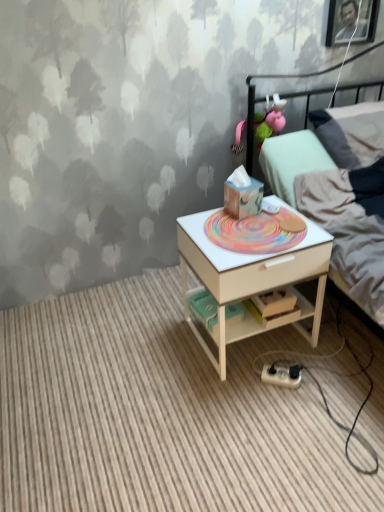
Question: Is point (279, 378) closer or farther from the camera than point (332, 211)?

Choices:
 (A) closer
 (B) farther

Answer: (A)

Question: From a real-world perspective, is white plastic power strip at lower center physically located above or below light gray fabric bed at upper right?

Choices:
 (A) below
 (B) above

Answer: (A)

Question: Estimate the real-world distances between objects in this image. Which object is farther from the white plastic power strip at lower center?

Choices:
 (A) white wood desk at center
 (B) pink fabric toy at upper center
 (C) light gray fabric bed at upper right
 (D) white wood nightstand at center

Answer: (B)

Question: Which object is the farthest from the pink fabric toy at upper center?

Choices:
 (A) light gray fabric bed at upper right
 (B) white wood nightstand at center
 (C) white plastic power strip at lower center
 (D) white wood desk at center

Answer: (B)